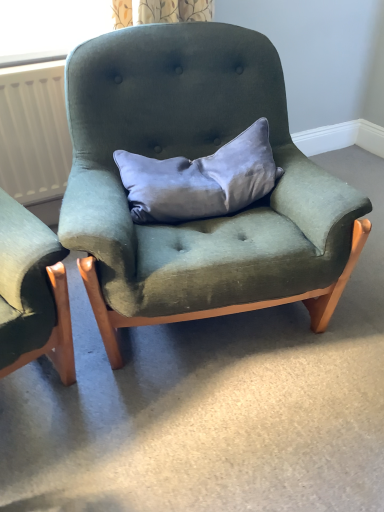
Question: Considering the relative sizes of velvet green armchair at center and white matte radiator at left in the image provided, is velvet green armchair at center shorter than white matte radiator at left?

Choices:
 (A) yes
 (B) no

Answer: (B)

Question: Is velvet green armchair at center facing away from white matte radiator at left?

Choices:
 (A) yes
 (B) no

Answer: (B)

Question: Is velvet green armchair at center positioned beyond the bounds of white matte radiator at left?

Choices:
 (A) no
 (B) yes

Answer: (B)

Question: Considering the relative sizes of velvet green armchair at center and white matte radiator at left in the image provided, is velvet green armchair at center wider than white matte radiator at left?

Choices:
 (A) no
 (B) yes

Answer: (B)

Question: Is the position of velvet green armchair at center less distant than that of white matte radiator at left?

Choices:
 (A) yes
 (B) no

Answer: (A)

Question: Based on their positions, is velvet green armchair at center located to the left or right of white matte radiator at left?

Choices:
 (A) left
 (B) right

Answer: (B)

Question: Relative to white matte radiator at left, is velvet green armchair at center in front or behind?

Choices:
 (A) front
 (B) behind

Answer: (A)

Question: From their relative heights in the image, would you say velvet green armchair at center is taller or shorter than white matte radiator at left?

Choices:
 (A) short
 (B) tall

Answer: (B)

Question: Which is correct: velvet green armchair at center is inside white matte radiator at left, or outside of it?

Choices:
 (A) inside
 (B) outside

Answer: (B)

Question: Considering the positions of point (226, 78) and point (142, 206), is point (226, 78) closer or farther from the camera than point (142, 206)?

Choices:
 (A) closer
 (B) farther

Answer: (B)

Question: From the image's perspective, is velvet green armchair at center positioned above or below satin gray pillow at center?

Choices:
 (A) above
 (B) below

Answer: (B)

Question: Considering the relative positions of velvet green armchair at center and satin gray pillow at center in the image provided, is velvet green armchair at center to the left or to the right of satin gray pillow at center?

Choices:
 (A) left
 (B) right

Answer: (A)

Question: Is velvet green armchair at center inside the boundaries of satin gray pillow at center, or outside?

Choices:
 (A) inside
 (B) outside

Answer: (B)

Question: Is satin gray pillow at center spatially inside white matte radiator at left, or outside of it?

Choices:
 (A) inside
 (B) outside

Answer: (B)

Question: Is point (180, 192) positioned closer to the camera than point (49, 101)?

Choices:
 (A) closer
 (B) farther

Answer: (A)